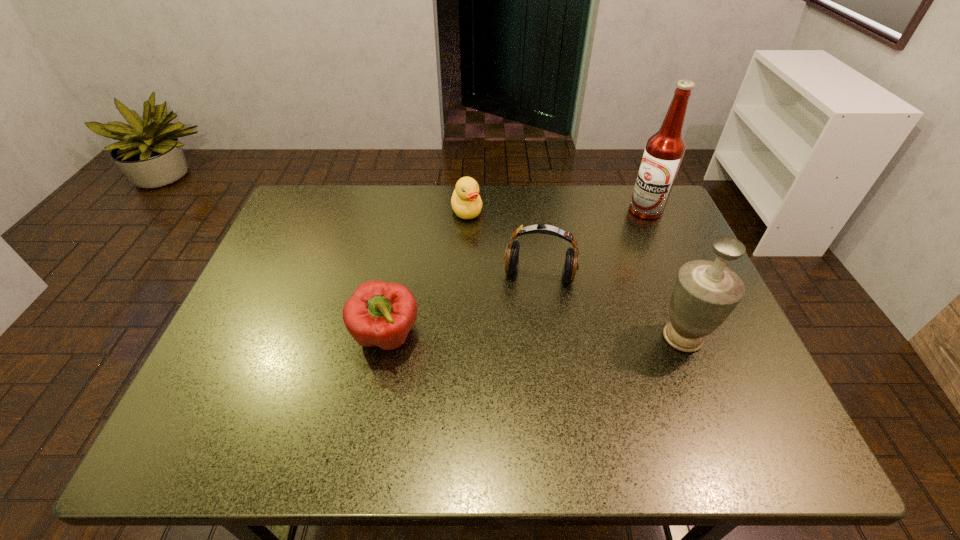
The image size is (960, 540). I want to click on vacant area in the image that satisfies the following two spatial constraints: 1. on the back side of the headset; 2. on the right side of the leftmost object, so pos(398,275).

At what (x,y) coordinates should I click in order to perform the action: click on free space that satisfies the following two spatial constraints: 1. on the back side of the third object from left to right; 2. on the left side of the tallest object. Please return your answer as a coordinate pair (x, y). This screenshot has height=540, width=960. Looking at the image, I should click on (531, 211).